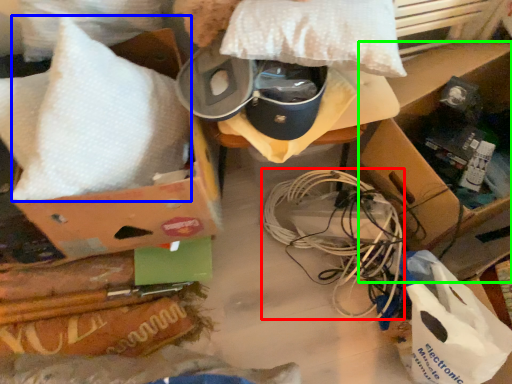
Question: Which is farther away from wire (highlighted by a red box)? pillow (highlighted by a blue box) or cardboard box (highlighted by a green box)?

Choices:
 (A) pillow
 (B) cardboard box

Answer: (A)